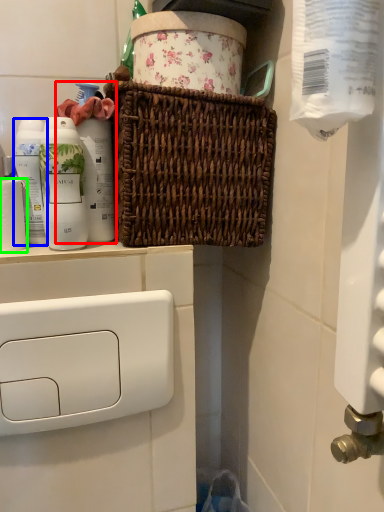
Question: Which object is positioned closest to cleaning product (highlighted by a red box)? Select from mouthwash (highlighted by a blue box) and toilet paper (highlighted by a green box).

Choices:
 (A) mouthwash
 (B) toilet paper

Answer: (A)